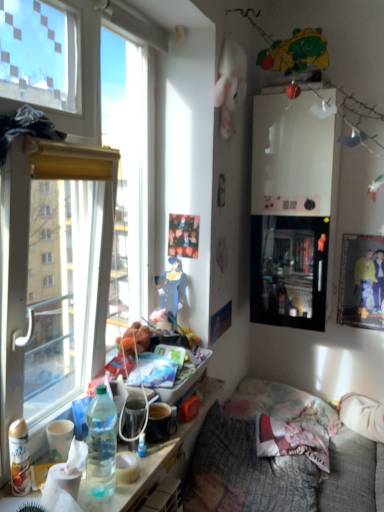
What is the approximate width of blue denim dress at center?

It is 2.46 inches.

Describe the element at coordinates (296, 52) in the screenshot. Image resolution: width=384 pixels, height=512 pixels. I see `plush green bear at upper right` at that location.

The image size is (384, 512). Find the location of `plush green bear at upper right`. plush green bear at upper right is located at coordinates (296, 52).

Where is `metallic glossy picture frame at upper right`? The width and height of the screenshot is (384, 512). metallic glossy picture frame at upper right is located at coordinates (361, 282).

This screenshot has width=384, height=512. Identify the location of fluffy fabric pillow at lower center. (292, 441).

This screenshot has height=512, width=384. What do you see at coordinates (277, 461) in the screenshot?
I see `textured gray fabric couch at lower right` at bounding box center [277, 461].

Where is `blue denim dress at center`? This screenshot has width=384, height=512. blue denim dress at center is located at coordinates (172, 288).

Is textured gray fabric couch at lower right taller or shorter than blue denim dress at center?

Considering their sizes, textured gray fabric couch at lower right has more height than blue denim dress at center.

Where is `person above the textured gray fabric couch at lower right (from a real-world perspective)`? person above the textured gray fabric couch at lower right (from a real-world perspective) is located at coordinates (172, 288).

What's the angular difference between textured gray fabric couch at lower right and blue denim dress at center's facing directions?

The angle between the facing direction of textured gray fabric couch at lower right and the facing direction of blue denim dress at center is 89.5 degrees.

Is the depth of textured gray fabric couch at lower right greater than that of blue denim dress at center?

No, it is not.

Find the location of `toy above the fluffy fabric pillow at lower center (from a real-world perspective)`. toy above the fluffy fabric pillow at lower center (from a real-world perspective) is located at coordinates [296, 52].

From a real-world perspective, which object stands above the other?

From a 3D spatial view, plush green bear at upper right is above.

How different are the orientations of fluffy fabric pillow at lower center and plush green bear at upper right in degrees?

The facing directions of fluffy fabric pillow at lower center and plush green bear at upper right are 92.2 degrees apart.

Does translucent plastic water bottle at lower left turn towards blue denim dress at center?

No.

Considering the relative sizes of translucent plastic water bottle at lower left and blue denim dress at center in the image provided, is translucent plastic water bottle at lower left shorter than blue denim dress at center?

Indeed, translucent plastic water bottle at lower left has a lesser height compared to blue denim dress at center.

Between translucent plastic water bottle at lower left and blue denim dress at center, which one is positioned behind?

blue denim dress at center.

Consider the image. From the image's perspective, is translucent plastic water bottle at lower left above blue denim dress at center?

Actually, translucent plastic water bottle at lower left appears below blue denim dress at center in the image.

Considering the positions of objects blue denim dress at center and translucent plastic water bottle at lower left in the image provided, who is more to the left, blue denim dress at center or translucent plastic water bottle at lower left?

translucent plastic water bottle at lower left.

From a real-world perspective, which object stands above the other?

In real-world perspective, blue denim dress at center is above.

Is blue denim dress at center taller or shorter than translucent plastic water bottle at lower left?

Considering their sizes, blue denim dress at center has more height than translucent plastic water bottle at lower left.

Looking at this image, is blue denim dress at center facing away from translucent plastic water bottle at lower left?

No.

Is textured gray fabric couch at lower right facing towards plush green bear at upper right?

No, textured gray fabric couch at lower right is not turned towards plush green bear at upper right.

Can you confirm if textured gray fabric couch at lower right is shorter than plush green bear at upper right?

In fact, textured gray fabric couch at lower right may be taller than plush green bear at upper right.

Is textured gray fabric couch at lower right touching plush green bear at upper right?

No, textured gray fabric couch at lower right is not with plush green bear at upper right.

Is textured gray fabric couch at lower right thinner than plush green bear at upper right?

No, textured gray fabric couch at lower right is not thinner than plush green bear at upper right.

From the image's perspective, who appears lower, translucent plastic water bottle at lower left or metallic glossy picture frame at upper right?

translucent plastic water bottle at lower left appears lower in the image.

Is translucent plastic water bottle at lower left wider than metallic glossy picture frame at upper right?

Yes.

From a real-world perspective, is translucent plastic water bottle at lower left above or below metallic glossy picture frame at upper right?

In terms of real-world spatial position, translucent plastic water bottle at lower left is below metallic glossy picture frame at upper right.

Is metallic glossy picture frame at upper right positioned with its back to fluffy fabric pillow at lower center?

No, metallic glossy picture frame at upper right is not facing the opposite direction of fluffy fabric pillow at lower center.

Who is taller, metallic glossy picture frame at upper right or fluffy fabric pillow at lower center?

metallic glossy picture frame at upper right.

From a real-world perspective, is metallic glossy picture frame at upper right on top of fluffy fabric pillow at lower center?

Yes, from a real-world perspective, metallic glossy picture frame at upper right is over fluffy fabric pillow at lower center

Does metallic glossy picture frame at upper right lie in front of fluffy fabric pillow at lower center?

That is False.

The width and height of the screenshot is (384, 512). What are the coordinates of `studio couch on the right of the blue denim dress at center` in the screenshot? It's located at (277, 461).

This screenshot has height=512, width=384. I want to click on toy above the fluffy fabric pillow at lower center (from a real-world perspective), so click(x=296, y=52).

From the image, which object appears to be farther from metallic glossy picture frame at upper right, textured gray fabric couch at lower right or translucent plastic water bottle at lower left?

Among the two, translucent plastic water bottle at lower left is located further to metallic glossy picture frame at upper right.

When comparing their distances from translucent plastic water bottle at lower left, does textured gray fabric couch at lower right or fluffy fabric pillow at lower center seem closer?

Based on the image, textured gray fabric couch at lower right appears to be nearer to translucent plastic water bottle at lower left.

Looking at the image, which one is located closer to metallic glossy picture frame at upper right, translucent plastic water bottle at lower left or textured gray fabric couch at lower right?

The object closer to metallic glossy picture frame at upper right is textured gray fabric couch at lower right.

Which object lies nearer to the anchor point plush green bear at upper right, metallic glossy picture frame at upper right or translucent plastic water bottle at lower left?

Based on the image, metallic glossy picture frame at upper right appears to be nearer to plush green bear at upper right.

Looking at the image, which one is located further to translucent plastic water bottle at lower left, blue denim dress at center or metallic glossy picture frame at upper right?

metallic glossy picture frame at upper right is positioned further to the anchor translucent plastic water bottle at lower left.

In the scene shown: Estimate the real-world distances between objects in this image. Which object is closer to metallic glossy picture frame at upper right, blue denim dress at center or fluffy fabric pillow at lower center?

Based on the image, fluffy fabric pillow at lower center appears to be nearer to metallic glossy picture frame at upper right.

Based on their spatial positions, is metallic glossy picture frame at upper right or plush green bear at upper right closer to translucent plastic water bottle at lower left?

The object closer to translucent plastic water bottle at lower left is metallic glossy picture frame at upper right.

From the image, which object appears to be nearer to translucent plastic water bottle at lower left, fluffy fabric pillow at lower center or metallic glossy picture frame at upper right?

fluffy fabric pillow at lower center is closer to translucent plastic water bottle at lower left.

Where is `studio couch between translucent plastic water bottle at lower left and blue denim dress at center from front to back`? studio couch between translucent plastic water bottle at lower left and blue denim dress at center from front to back is located at coordinates (277, 461).

Locate an element on the screen. pillow located between translucent plastic water bottle at lower left and textured gray fabric couch at lower right in the left-right direction is located at coordinates (292, 441).

Where is `person between translucent plastic water bottle at lower left and metallic glossy picture frame at upper right from left to right`? This screenshot has height=512, width=384. person between translucent plastic water bottle at lower left and metallic glossy picture frame at upper right from left to right is located at coordinates (172, 288).

Find the location of a particular element. The image size is (384, 512). pillow between blue denim dress at center and textured gray fabric couch at lower right in the up-down direction is located at coordinates (292, 441).